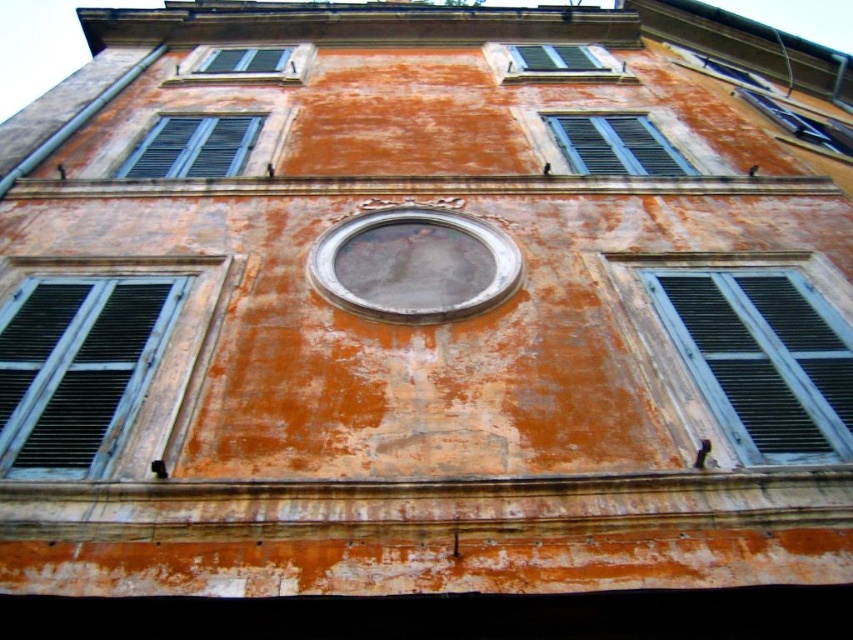
You are an architect analyzing the building facade. You need to determine which of the two shutters, the blue matte shutter at left or the green matte shutters at upper center, requires a wider material for construction. Based on the image, which one would need more material in terms of width?

The green matte shutters at upper center require more material in terms of width since they are wider than the blue matte shutter at left.

You are an architect analyzing the building facade. You need to determine which of the two shutters, the matte black shutters at right or the blue matte shutter at left, requires more material for a new paint job. Based on their sizes, which one would need more paint?

The matte black shutters at right is much taller than the blue matte shutter at left, so it would require more paint.

You are an architect designing a new building inspired by this facade. The blue matte shutter at left and the blue matte window at upper center are important elements. If you want to replicate the spacing between them, how far apart should you place them?

The blue matte shutter at left and the blue matte window at upper center should be placed 7.16 meters apart to accurately replicate the spacing seen in the original facade.